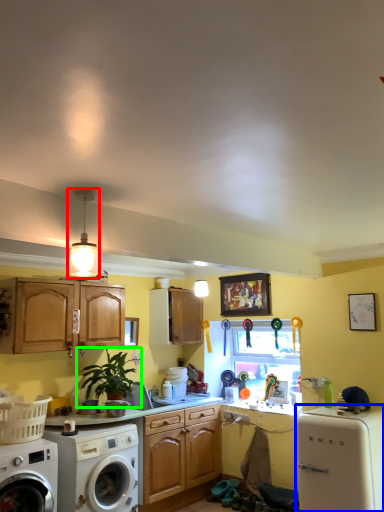
Question: Estimate the real-world distances between objects in this image. Which object is farther from light fixture (highlighted by a red box), dish washer (highlighted by a blue box) or houseplant (highlighted by a green box)?

Choices:
 (A) dish washer
 (B) houseplant

Answer: (A)